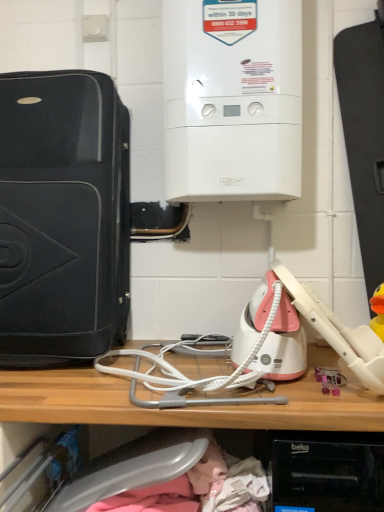
This screenshot has width=384, height=512. What are the coordinates of `free point behind pink plastic toy at lower right` in the screenshot? It's located at (318, 361).